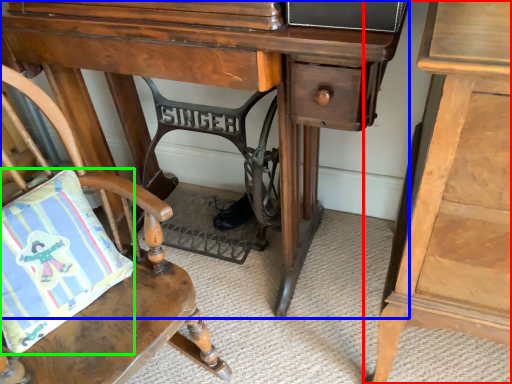
Question: Which object is positioned closest to nightstand (highlighted by a red box)? Select from desk (highlighted by a blue box) and pillow (highlighted by a green box).

Choices:
 (A) desk
 (B) pillow

Answer: (A)